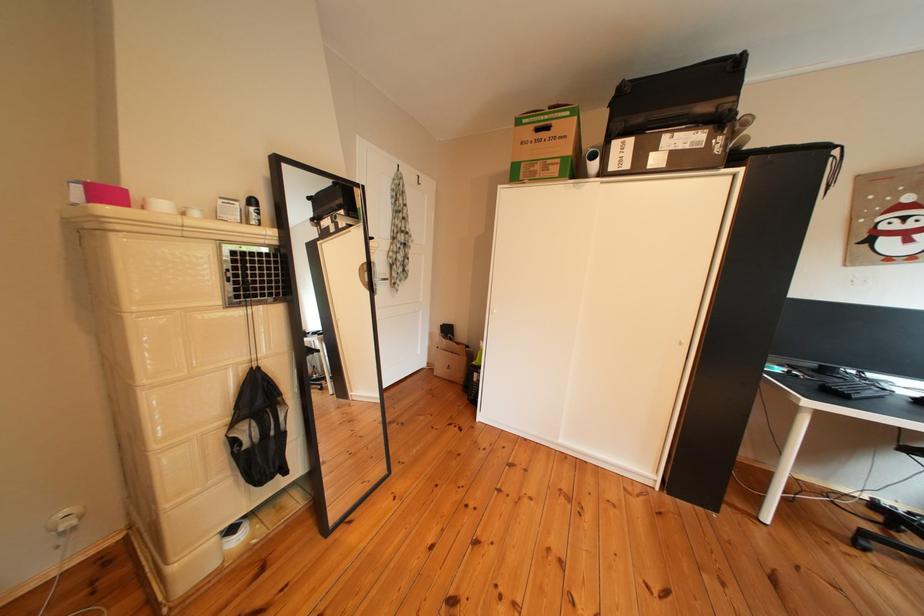
Find where to pull the metallic door handle. Please return your answer as a coordinate pair (x, y).

(382, 277)